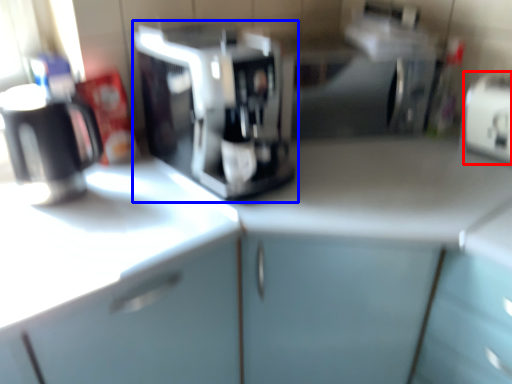
Question: Which object is further to the camera taking this photo, appliance (highlighted by a red box) or coffee maker (highlighted by a blue box)?

Choices:
 (A) appliance
 (B) coffee maker

Answer: (A)